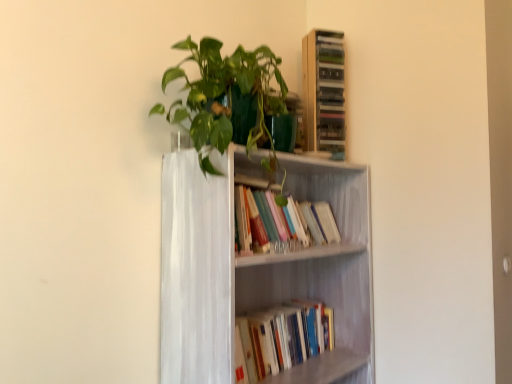
Question: Is wooden cabinet at upper right next to white painted wood bookcase at center and touching it?

Choices:
 (A) yes
 (B) no

Answer: (B)

Question: From the image's perspective, is wooden cabinet at upper right located above white painted wood bookcase at center?

Choices:
 (A) no
 (B) yes

Answer: (B)

Question: From a real-world perspective, is wooden cabinet at upper right physically below white painted wood bookcase at center?

Choices:
 (A) no
 (B) yes

Answer: (A)

Question: Can you confirm if wooden cabinet at upper right is thinner than white painted wood bookcase at center?

Choices:
 (A) yes
 (B) no

Answer: (A)

Question: Does wooden cabinet at upper right appear on the right side of white painted wood bookcase at center?

Choices:
 (A) no
 (B) yes

Answer: (B)

Question: Is wooden cabinet at upper right oriented away from white painted wood bookcase at center?

Choices:
 (A) no
 (B) yes

Answer: (A)

Question: Is hardcover books at center, the second book when ordered from top to bottom, with green glossy plant at upper center?

Choices:
 (A) yes
 (B) no

Answer: (B)

Question: Is hardcover books at center, the second book when ordered from top to bottom, not close to green glossy plant at upper center?

Choices:
 (A) no
 (B) yes

Answer: (A)

Question: Is hardcover books at center, the second book when ordered from top to bottom, positioned behind green glossy plant at upper center?

Choices:
 (A) yes
 (B) no

Answer: (A)

Question: Is green glossy plant at upper center at the back of hardcover books at center, the second book when ordered from top to bottom?

Choices:
 (A) yes
 (B) no

Answer: (B)

Question: From the image's perspective, would you say hardcover books at center, the second book when ordered from top to bottom, is positioned over green glossy plant at upper center?

Choices:
 (A) yes
 (B) no

Answer: (B)

Question: Could you tell me if hardcover books at center, the second book when ordered from top to bottom, is turned towards green glossy plant at upper center?

Choices:
 (A) yes
 (B) no

Answer: (B)

Question: Is hardcover books at center, the second book when ordered from top to bottom, at the back of wooden cabinet at upper right?

Choices:
 (A) no
 (B) yes

Answer: (A)